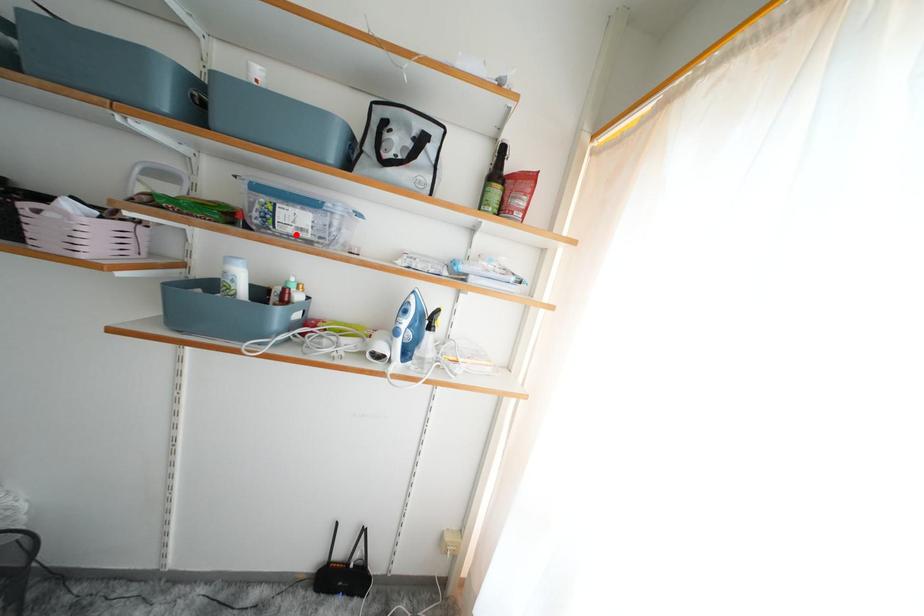
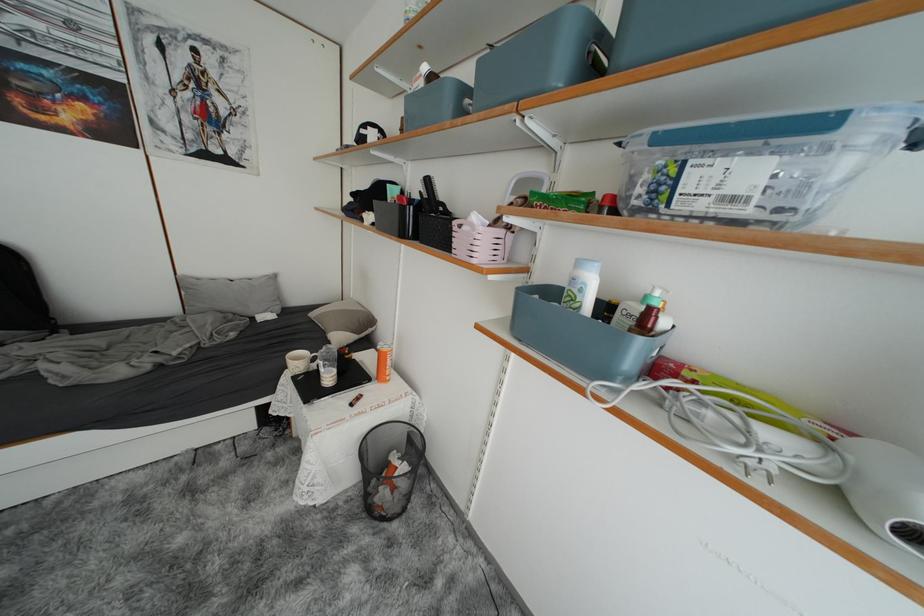
Question: I am providing you with two images of the same scene from different viewpoints. A red point is marked on the first image. Can you still see the location of the red point in image 2?

Choices:
 (A) Yes
 (B) No

Answer: (A)